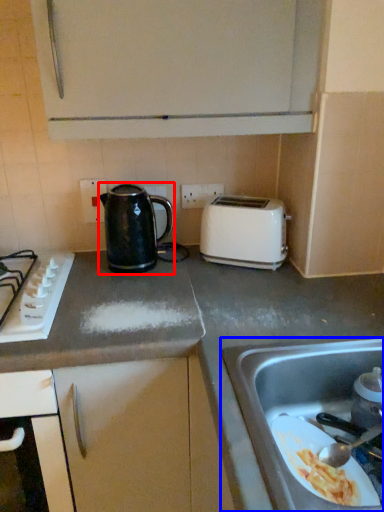
Question: Which of the following is the closest to the observer, kettle (highlighted by a red box) or sink (highlighted by a blue box)?

Choices:
 (A) kettle
 (B) sink

Answer: (B)